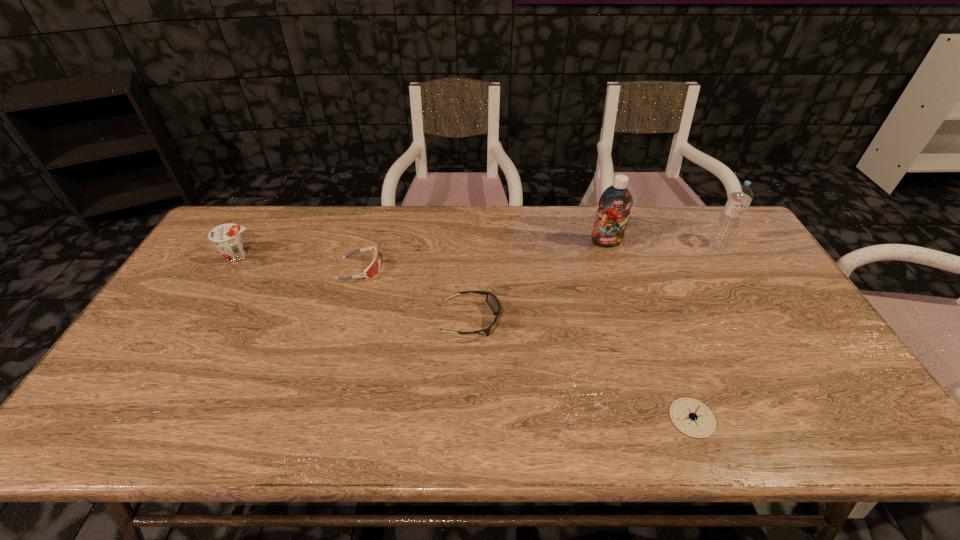
I want to click on free location that satisfies the following two spatial constraints: 1. on the back side of the nearest object; 2. on the lenses of the third object from left to right, so click(656, 320).

Identify the location of vacant area that satisfies the following two spatial constraints: 1. on the front label of the nearest object; 2. on the left side of the shampoo. The width and height of the screenshot is (960, 540). (662, 418).

Locate an element on the screen. Image resolution: width=960 pixels, height=540 pixels. free location that satisfies the following two spatial constraints: 1. on the front-facing side of the nearest object; 2. on the left side of the left goggles is located at coordinates (317, 418).

Locate an element on the screen. vacant point that satisfies the following two spatial constraints: 1. on the lenses of the second nearest object; 2. on the right side of the compass is located at coordinates (468, 418).